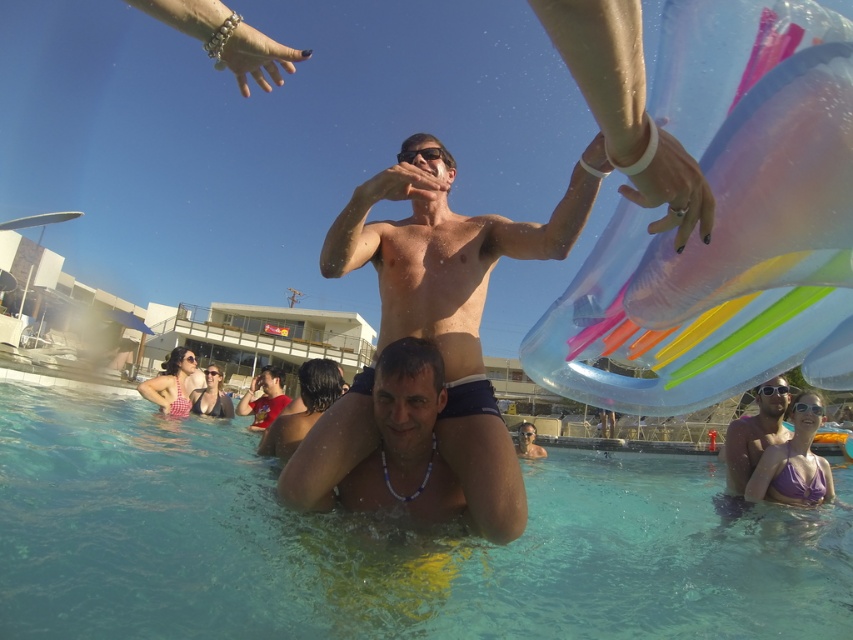
You are standing at the edge of the pool and want to jump into the clear blue water at center. Based on the coordinates provided, where exactly should you aim to land?

The clear blue water at center is located at coordinates point (380, 545), so you should aim for that exact point to land in the clear blue water at center.

You are a photographer positioned at the edge of the pool. You want to take a photo that includes both the matte purple swimsuit at lower right and the smooth red shirt at center. Given that your camera has a maximum focal length that allows capturing objects up to 5 meters apart in the frame, will you be able to include both subjects in the same photo?

The matte purple swimsuit at lower right and smooth red shirt at center are 4.65 meters apart from each other. Since the distance between them is less than the camera maximum focal length of 5 meters, you can include both subjects in the same photo.